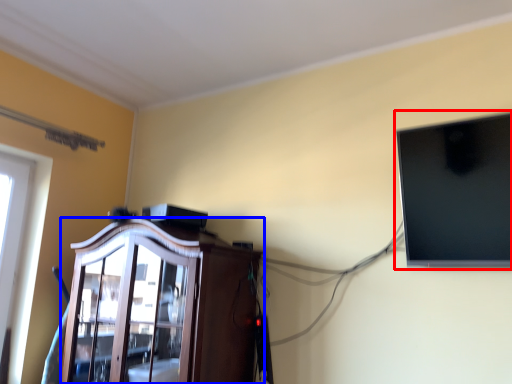
Question: Among these objects, which one is nearest to the camera, computer monitor (highlighted by a red box) or cabinetry (highlighted by a blue box)?

Choices:
 (A) computer monitor
 (B) cabinetry

Answer: (A)